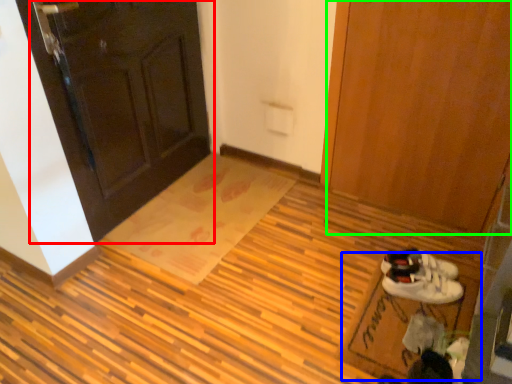
Question: Which object is the farthest from door (highlighted by a red box)? Choose among these: doormat (highlighted by a blue box) or door (highlighted by a green box).

Choices:
 (A) doormat
 (B) door

Answer: (A)